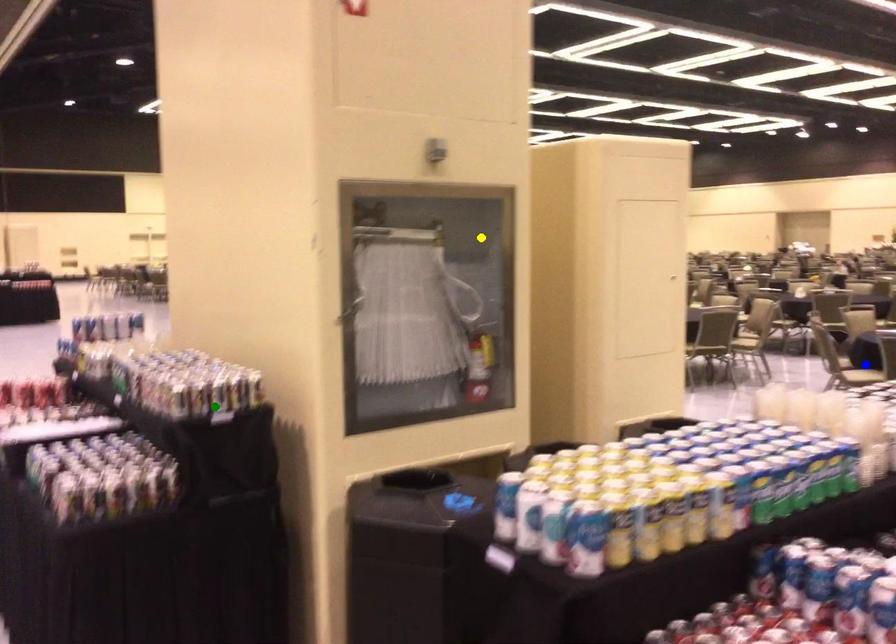
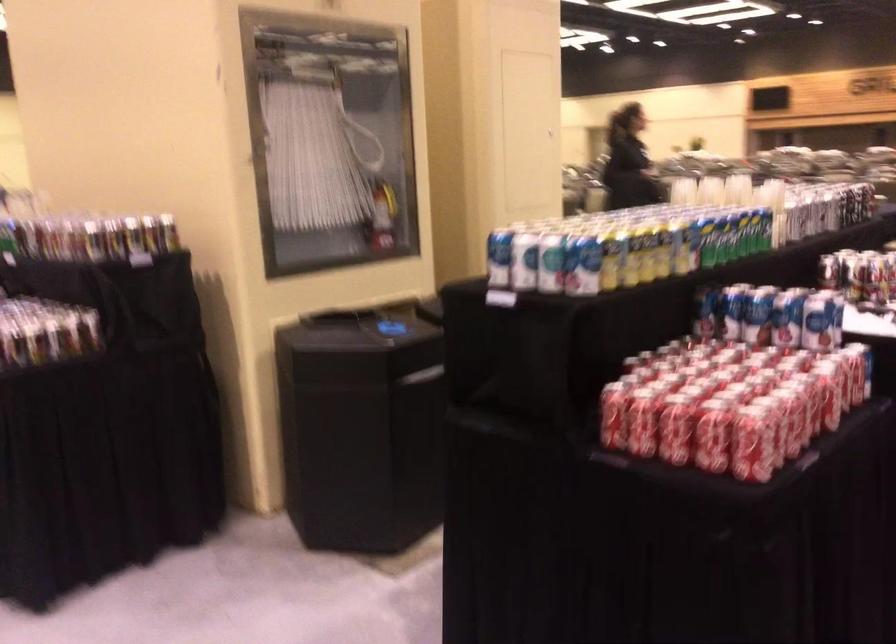
I am providing you with two images of the same scene from different viewpoints. Three points are marked in image1. Which point corresponds to a part or object that is occluded in image2?In image1, three points are marked. Which of them correspond to a part or object that is occluded in image2?Among the three points shown in image1, which one corresponds to a part or object that is no longer visible due to occlusion in image2?

blue point cannot be seen in image2.